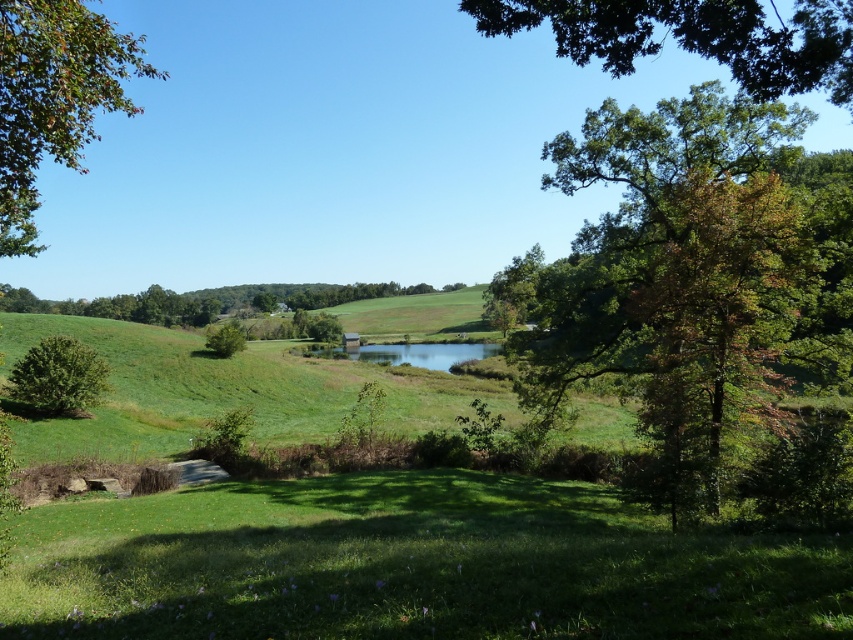
You are standing in the rural landscape and want to take a photo of the green leafy tree at right. If your camera has a maximum zoom range of 100 feet, will you be able to capture the tree clearly without moving closer?

The green leafy tree at right is 42.68 feet away from the viewer. Since the camera can zoom up to 100 feet, it is within the maximum range. Therefore, you can capture the tree clearly without moving closer.

You are a bird flying over the rural landscape. You spot the green leafy tree at upper right and the green matte tree at lower left. Which tree would you land on first if you are flying from the top of the image downward?

You would land on the green leafy tree at upper right first because it is located above the green matte tree at lower left.

You are standing at the point with coordinates point (822, 32) and want to walk towards the point (57, 397). Which direction should you move to reach there?

You should move towards the direction of point (57, 397), which is behind point (822, 32) in the scene.